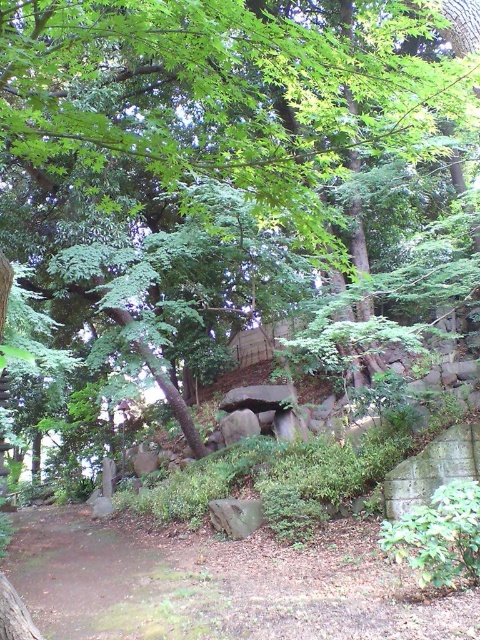
Between brown dirt path at lower center and rough gray rock at center, which one appears on the left side from the viewer's perspective?

rough gray rock at center

Who is positioned more to the right, brown dirt path at lower center or rough gray rock at center?

brown dirt path at lower center is more to the right.

Does point (74, 636) come farther from viewer compared to point (245, 433)?

No, (74, 636) is in front of (245, 433).

Where is `brown dirt path at lower center`? brown dirt path at lower center is located at coordinates point(225,580).